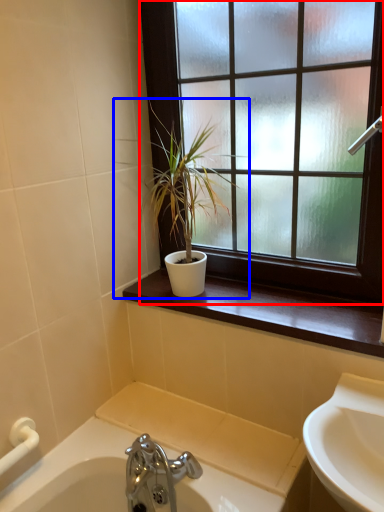
Question: Which object is further to the camera taking this photo, window (highlighted by a red box) or houseplant (highlighted by a blue box)?

Choices:
 (A) window
 (B) houseplant

Answer: (B)